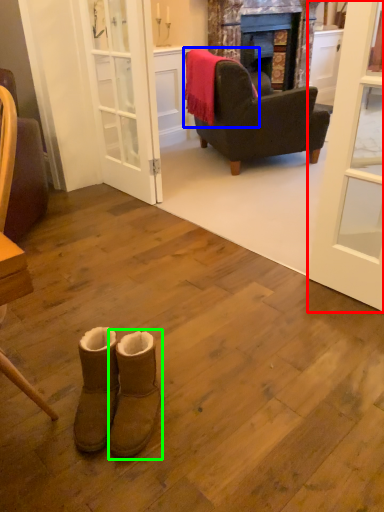
Question: Estimate the real-world distances between objects in this image. Which object is closer to door (highlighted by a red box), blanket (highlighted by a blue box) or footwear (highlighted by a green box)?

Choices:
 (A) blanket
 (B) footwear

Answer: (B)